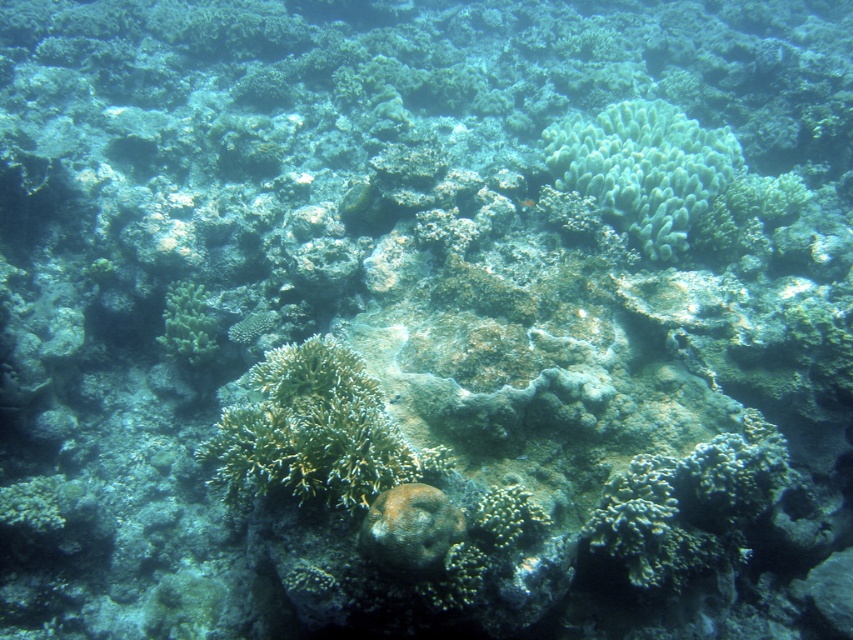
You are a scuba diver swimming in the coral reef. You see the green soft coral at upper center and the shiny orange fish at center. Which object is closer to you?

The green soft coral at upper center is closer to you because it is further to the viewer than the shiny orange fish at center.

You are a marine biologist examining an underwater image of a coral reef. You need to locate the green soft coral at upper center. What are the coordinates where you should focus your attention?

The green soft coral at upper center is located at coordinates point (643, 168).

You are a marine biologist studying coral reefs. You observe the green textured coral at center and the green matte coral at lower left in the image. Which coral has a greater height?

The green textured coral at center is taller than the green matte coral at lower left.